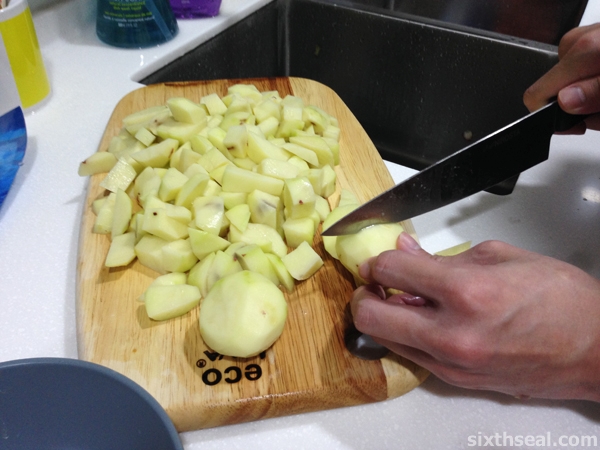
Identify the location of white countertop. (34, 272), (452, 430).